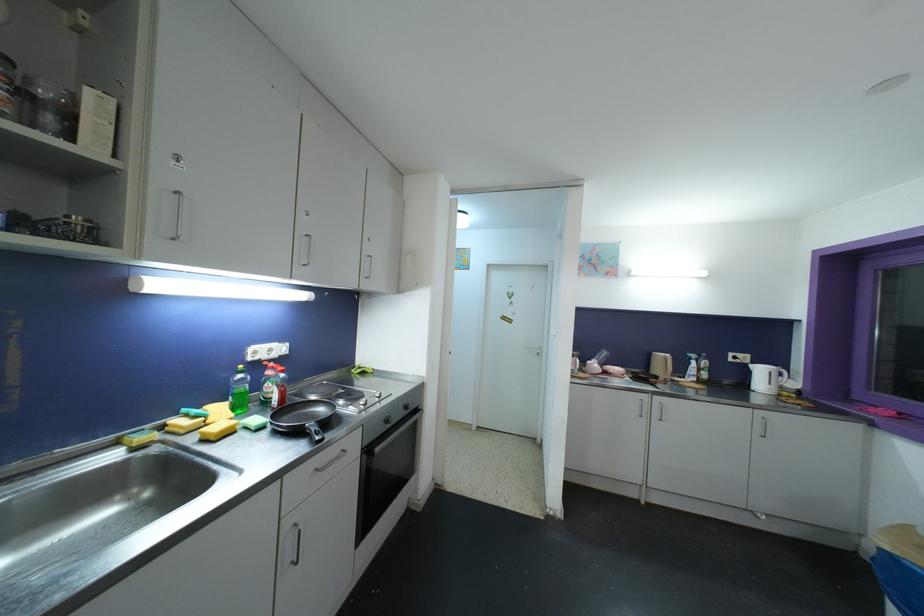
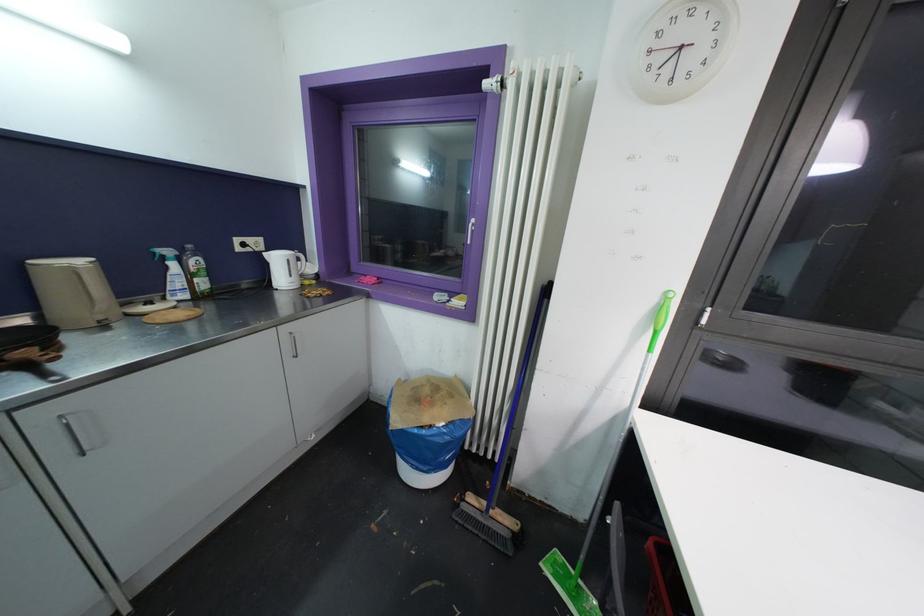
Locate, in the second image, the point that corresponds to point (696, 359) in the first image.

(171, 254)